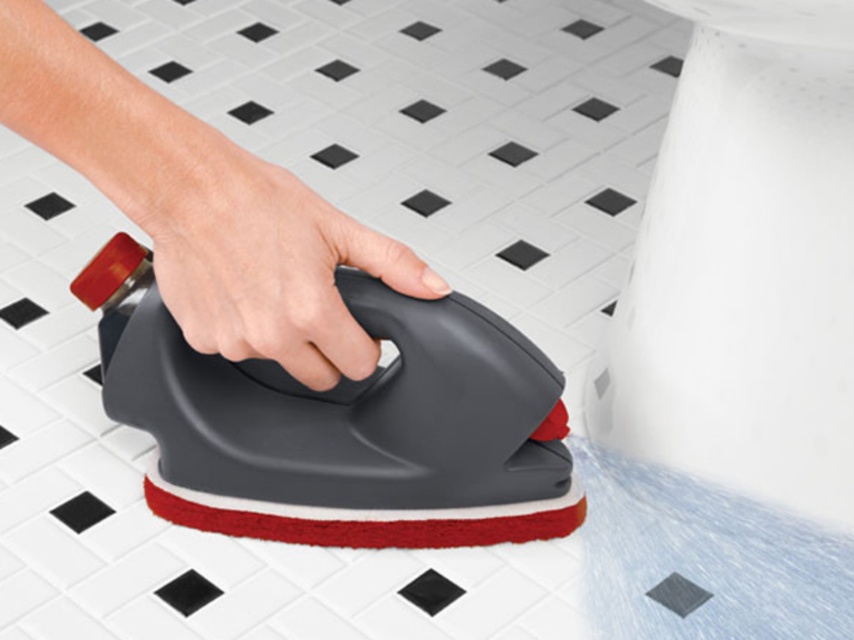
You are a cleaning robot observing a person using a cleaning device on a tiled floor. The device has a matte black scrubber at center and a gray matte sponge at center. Which object is closer to you?

The matte black scrubber at center is closer to you because it is in front of the gray matte sponge at center.

You are a cleaning assistant. You see the matte black scrubber at center and the gray matte sponge at center. Which one is directly on top of the other?

The matte black scrubber at center is positioned over the gray matte sponge at center.

You are trying to determine which object is higher when looking at the image. The scene has a person cleaning a black and white tiled floor with a device that has a red handle and scrubbing pad. You see a matte black scrubber at center and a gray matte sponge at center. Which one is taller?

The matte black scrubber at center is taller than the gray matte sponge at center.